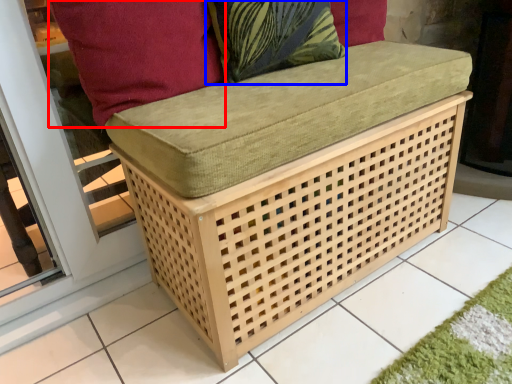
Question: Which of the following is the farthest to the observer, pillow (highlighted by a red box) or throw pillow (highlighted by a blue box)?

Choices:
 (A) pillow
 (B) throw pillow

Answer: (B)